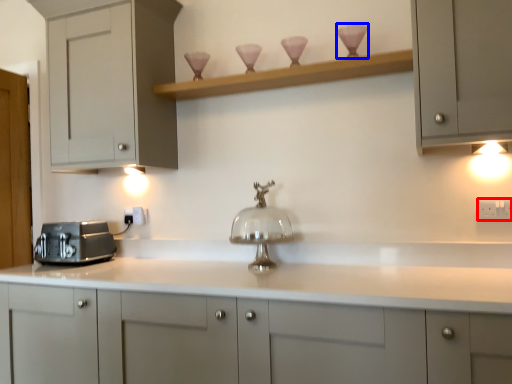
Question: Which object appears farthest to the camera in this image, electric outlet (highlighted by a red box) or candle holder (highlighted by a blue box)?

Choices:
 (A) electric outlet
 (B) candle holder

Answer: (B)